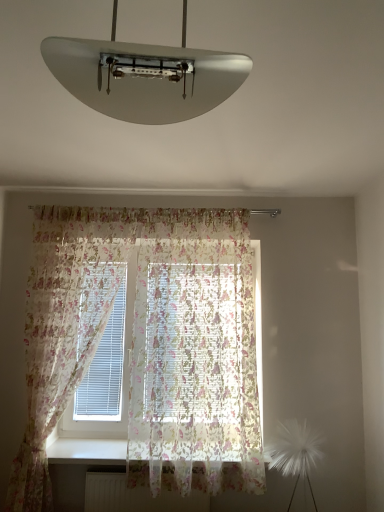
Question: Based on their positions, is white glossy lampshade at upper center located to the left or right of white matte radiator at lower center?

Choices:
 (A) right
 (B) left

Answer: (A)

Question: Choose the correct answer: Is white glossy lampshade at upper center inside white matte radiator at lower center or outside it?

Choices:
 (A) outside
 (B) inside

Answer: (A)

Question: Estimate the real-world distances between objects in this image. Which object is farther from the white smooth window sill at lower center?

Choices:
 (A) white glossy lampshade at upper center
 (B) translucent floral fabric at left, which is the first curtain from left to right
 (C) white matte radiator at lower center
 (D) translucent floral curtain at center, which is the second curtain from left to right

Answer: (A)

Question: Estimate the real-world distances between objects in this image. Which object is farther from the translucent floral fabric at left, which is the second curtain from right to left?

Choices:
 (A) white glossy lampshade at upper center
 (B) white matte radiator at lower center
 (C) translucent floral curtain at center, arranged as the first curtain when viewed from the right
 (D) white smooth window sill at lower center

Answer: (A)